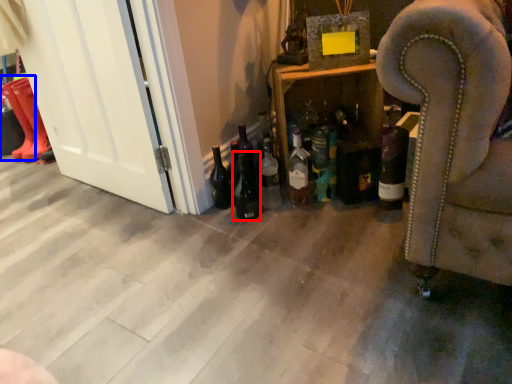
Question: Which object is further to the camera taking this photo, beer bottle (highlighted by a red box) or boot (highlighted by a blue box)?

Choices:
 (A) beer bottle
 (B) boot

Answer: (B)